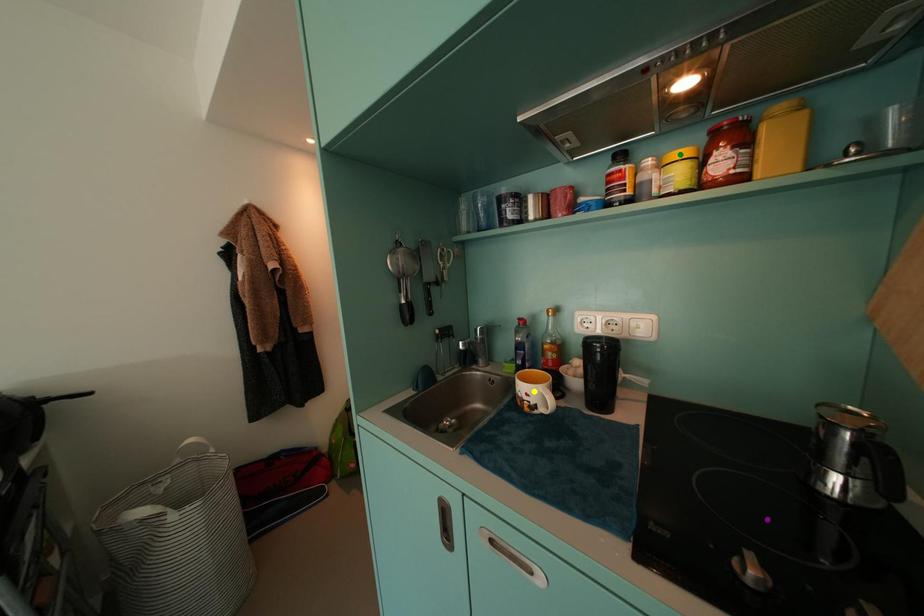
Order these from nearest to farthest:
1. purple point
2. yellow point
3. green point

purple point → green point → yellow point